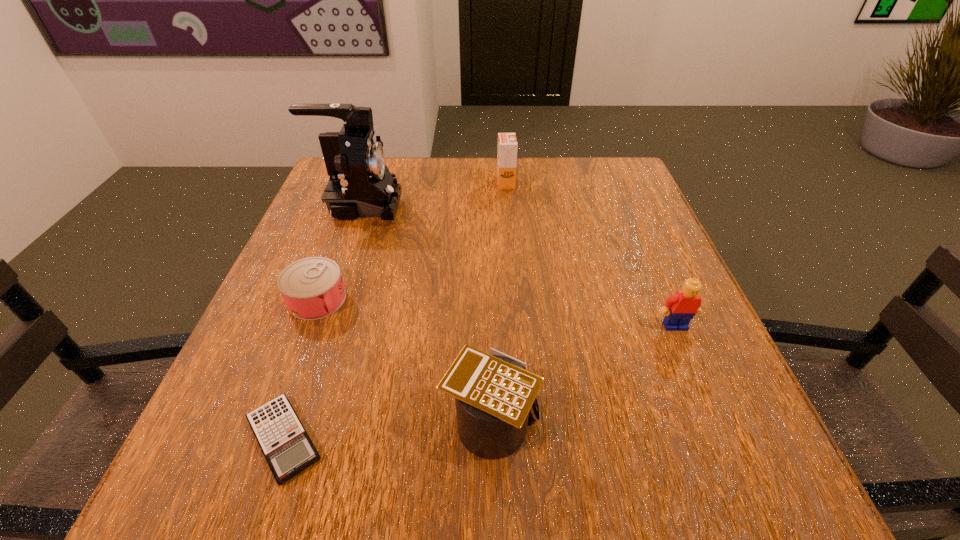
Locate an element on the screen. The height and width of the screenshot is (540, 960). vacant space that's between the orange juice and the can is located at coordinates (411, 241).

Where is `free point between the right calculator and the orange juice`? This screenshot has height=540, width=960. free point between the right calculator and the orange juice is located at coordinates (498, 301).

At what (x,y) coordinates should I click in order to perform the action: click on empty space between the Lego and the camcorder. Please return your answer as a coordinate pair (x, y). Looking at the image, I should click on (517, 266).

At what (x,y) coordinates should I click in order to perform the action: click on vacant space that is in between the left calculator and the right calculator. Please return your answer as a coordinate pair (x, y). Looking at the image, I should click on (387, 429).

This screenshot has height=540, width=960. Find the location of `free space between the second shortest object and the shorter calculator`. free space between the second shortest object and the shorter calculator is located at coordinates (300, 369).

The height and width of the screenshot is (540, 960). Find the location of `free space between the tallest object and the shorter calculator`. free space between the tallest object and the shorter calculator is located at coordinates (322, 322).

Locate an element on the screen. The height and width of the screenshot is (540, 960). free space between the orange juice and the shortest object is located at coordinates (395, 311).

The image size is (960, 540). Identify the location of object that can be found as the fourth closest to the right calculator. (360, 185).

This screenshot has height=540, width=960. In order to click on object that is the second closest to the left calculator in this screenshot , I will do `click(494, 393)`.

This screenshot has height=540, width=960. Find the location of `vacant region that satisfies the following two spatial constraints: 1. on the front side of the can; 2. on the right side of the left calculator`. vacant region that satisfies the following two spatial constraints: 1. on the front side of the can; 2. on the right side of the left calculator is located at coordinates (265, 438).